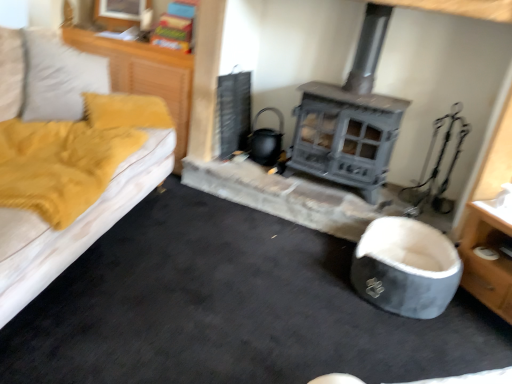
Where is `wooden dresser at lower right, positioned as the first dresser in right-to-left order`? wooden dresser at lower right, positioned as the first dresser in right-to-left order is located at coordinates (487, 260).

Measure the distance between point (498, 243) and camera.

The distance of point (498, 243) from camera is 6.45 feet.

Identify the location of yellow fabric at left, which appears as the second dresser when viewed from the right. This screenshot has height=384, width=512. (145, 75).

Locate an element on the screen. This screenshot has width=512, height=384. wooden dresser at lower right, the 1th dresser from the bottom is located at coordinates (487, 260).

Is yellow fabric at left, which ranks as the 1th dresser in left-to-right order, positioned with its back to gray fabric bean bag at lower right?

No, yellow fabric at left, which ranks as the 1th dresser in left-to-right order, is not facing the opposite direction of gray fabric bean bag at lower right.

Is the position of yellow fabric at left, which appears as the second dresser when viewed from the right, more distant than that of gray fabric bean bag at lower right?

That is True.

Which of these two, yellow fabric at left, which appears as the second dresser when viewed from the right, or gray fabric bean bag at lower right, stands shorter?

With less height is gray fabric bean bag at lower right.

From the image's perspective, is yellow fabric at left, which ranks as the 1th dresser in left-to-right order, above gray fabric bean bag at lower right?

Yes.

Between wooden dresser at lower right, the 1th dresser from the bottom, and gray fabric bean bag at lower right, which one has larger width?

wooden dresser at lower right, the 1th dresser from the bottom.

Based on the photo, is gray fabric bean bag at lower right at the back of wooden dresser at lower right, which is counted as the 2th dresser, starting from the top?

That's not correct — wooden dresser at lower right, which is counted as the 2th dresser, starting from the top, is not looking away from gray fabric bean bag at lower right.

Based on the photo, from a real-world perspective, between wooden dresser at lower right, which is counted as the 2th dresser, starting from the top, and gray fabric bean bag at lower right, who is vertically lower?

gray fabric bean bag at lower right, from a real-world perspective.

Who is shorter, wooden dresser at lower right, the second dresser in the left-to-right sequence, or gray fabric bean bag at lower right?

gray fabric bean bag at lower right.

Does point (428, 256) come closer to viewer compared to point (190, 101)?

Yes, it is.

Is gray fabric bean bag at lower right oriented away from yellow fabric at left, the 1th dresser positioned from the top?

No, gray fabric bean bag at lower right's orientation is not away from yellow fabric at left, the 1th dresser positioned from the top.

Between gray fabric bean bag at lower right and yellow fabric at left, which appears as the second dresser when ordered from the bottom, which one appears on the left side from the viewer's perspective?

yellow fabric at left, which appears as the second dresser when ordered from the bottom, is more to the left.

Is yellow fabric at left, which ranks as the 1th dresser in left-to-right order, looking in the opposite direction of wooden dresser at lower right, the second dresser in the left-to-right sequence?

That's not correct — yellow fabric at left, which ranks as the 1th dresser in left-to-right order, is not looking away from wooden dresser at lower right, the second dresser in the left-to-right sequence.

Between yellow fabric at left, which appears as the second dresser when ordered from the bottom, and wooden dresser at lower right, which is counted as the 2th dresser, starting from the top, which one has less height?

wooden dresser at lower right, which is counted as the 2th dresser, starting from the top, is shorter.

The image size is (512, 384). I want to click on dresser behind the wooden dresser at lower right, which is counted as the 2th dresser, starting from the top, so click(x=145, y=75).

Can you confirm if yellow fabric at left, which appears as the second dresser when ordered from the bottom, is wider than wooden dresser at lower right, the 1th dresser from the bottom?

No.

Considering the sizes of wooden dresser at lower right, positioned as the first dresser in right-to-left order, and yellow fabric at left, the 1th dresser positioned from the top, in the image, is wooden dresser at lower right, positioned as the first dresser in right-to-left order, bigger or smaller than yellow fabric at left, the 1th dresser positioned from the top,?

In the image, wooden dresser at lower right, positioned as the first dresser in right-to-left order, appears to be larger than yellow fabric at left, the 1th dresser positioned from the top.

Between point (471, 286) and point (188, 117), which one is positioned behind?

Point (188, 117)

Is wooden dresser at lower right, which is counted as the 2th dresser, starting from the top, wider or thinner than yellow fabric at left, which ranks as the 1th dresser in left-to-right order?

Considering their sizes, wooden dresser at lower right, which is counted as the 2th dresser, starting from the top, looks broader than yellow fabric at left, which ranks as the 1th dresser in left-to-right order.

From the image's perspective, who appears lower, wooden dresser at lower right, which is counted as the 2th dresser, starting from the top, or yellow fabric at left, which appears as the second dresser when ordered from the bottom?

wooden dresser at lower right, which is counted as the 2th dresser, starting from the top, appears lower in the image.

Is wooden dresser at lower right, the 1th dresser from the bottom, completely or partially inside gray fabric bean bag at lower right?

That's incorrect, wooden dresser at lower right, the 1th dresser from the bottom, is not inside gray fabric bean bag at lower right.

Which is in front, point (388, 217) or point (471, 289)?

The point (471, 289) is more forward.

Is the position of gray fabric bean bag at lower right less distant than that of wooden dresser at lower right, positioned as the first dresser in right-to-left order?

No, gray fabric bean bag at lower right is further to the viewer.

Looking at this image, measure the distance from gray fabric bean bag at lower right to wooden dresser at lower right, positioned as the first dresser in right-to-left order.

gray fabric bean bag at lower right and wooden dresser at lower right, positioned as the first dresser in right-to-left order, are 10.02 inches apart from each other.

Where is `bean bag chair below the yellow fabric at left, which appears as the second dresser when ordered from the bottom (from a real-world perspective)`? The height and width of the screenshot is (384, 512). bean bag chair below the yellow fabric at left, which appears as the second dresser when ordered from the bottom (from a real-world perspective) is located at coordinates (406, 267).

The height and width of the screenshot is (384, 512). Find the location of `dresser that is in front of the gray fabric bean bag at lower right`. dresser that is in front of the gray fabric bean bag at lower right is located at coordinates (487, 260).

Looking at the image, which one is located further to wooden dresser at lower right, which is counted as the 2th dresser, starting from the top, yellow fabric at left, which appears as the second dresser when viewed from the right, or gray fabric bean bag at lower right?

yellow fabric at left, which appears as the second dresser when viewed from the right, lies further to wooden dresser at lower right, which is counted as the 2th dresser, starting from the top, than the other object.

From the image, which object appears to be farther from yellow fabric at left, which appears as the second dresser when ordered from the bottom, gray fabric bean bag at lower right or wooden dresser at lower right, which is counted as the 2th dresser, starting from the top?

Among the two, wooden dresser at lower right, which is counted as the 2th dresser, starting from the top, is located further to yellow fabric at left, which appears as the second dresser when ordered from the bottom.

Considering their positions, is wooden dresser at lower right, which is counted as the 2th dresser, starting from the top, positioned closer to gray fabric bean bag at lower right than yellow fabric at left, which appears as the second dresser when ordered from the bottom?

Based on the image, wooden dresser at lower right, which is counted as the 2th dresser, starting from the top, appears to be nearer to gray fabric bean bag at lower right.

Which object lies nearer to the anchor point wooden dresser at lower right, the 1th dresser from the bottom, gray fabric bean bag at lower right or yellow fabric at left, which ranks as the 1th dresser in left-to-right order?

Based on the image, gray fabric bean bag at lower right appears to be nearer to wooden dresser at lower right, the 1th dresser from the bottom.

Considering their positions, is wooden dresser at lower right, which is counted as the 2th dresser, starting from the top, positioned further to yellow fabric at left, the 1th dresser positioned from the top, than gray fabric bean bag at lower right?

wooden dresser at lower right, which is counted as the 2th dresser, starting from the top, is positioned further to the anchor yellow fabric at left, the 1th dresser positioned from the top.

Which object lies further to the anchor point gray fabric bean bag at lower right, yellow fabric at left, the 1th dresser positioned from the top, or wooden dresser at lower right, the second dresser in the left-to-right sequence?

yellow fabric at left, the 1th dresser positioned from the top, is further to gray fabric bean bag at lower right.

At what (x,y) coordinates should I click in order to perform the action: click on bean bag chair between yellow fabric at left, the 1th dresser positioned from the top, and wooden dresser at lower right, positioned as the first dresser in right-to-left order, in the horizontal direction. Please return your answer as a coordinate pair (x, y). Looking at the image, I should click on (406, 267).